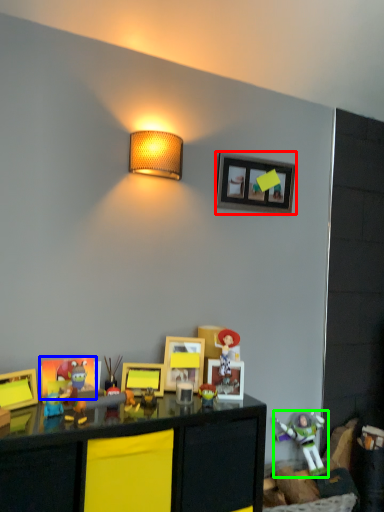
Question: Which object is the closest to the picture frame (highlighted by a red box)? Choose among these: picture frame (highlighted by a blue box) or toy (highlighted by a green box).

Choices:
 (A) picture frame
 (B) toy

Answer: (A)